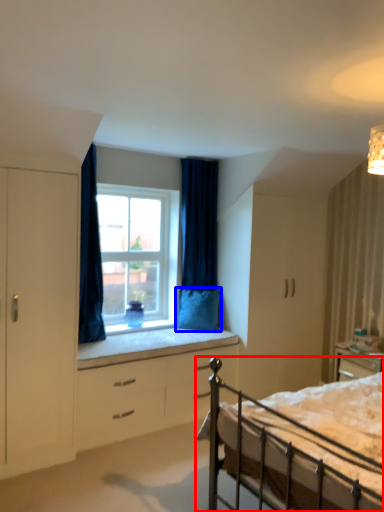
Question: Among these objects, which one is farthest to the camera, bed (highlighted by a red box) or pillow (highlighted by a blue box)?

Choices:
 (A) bed
 (B) pillow

Answer: (B)